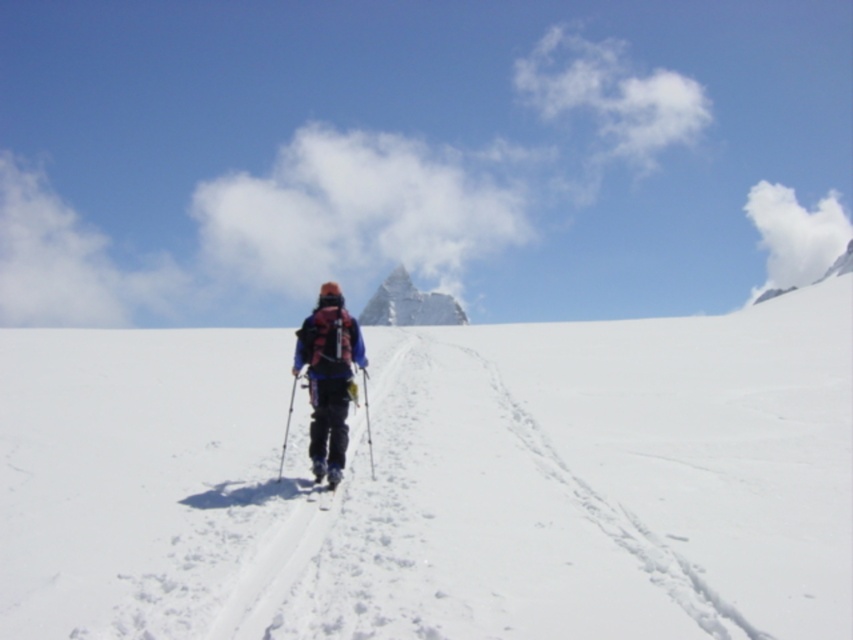
You are a hiker planning to cross the snow path. You have a white matte ski at center that you need to place on the white powdery snow at center. Can you confirm if the ski will reach the snow without needing to move it more than 90 feet?

The distance between the white powdery snow at center and the white matte ski at center is 91.75 feet, which exceeds the 90 feet limit. Therefore, the ski cannot reach the snow without moving it further.

You are a photographer capturing the snowy mountain scene. You want to ensure the matte black ski pole at center is visible in the foreground without being obstructed by the white fluffy cloud at upper right. Is this possible?

The matte black ski pole at center is behind the white fluffy cloud at upper right, so it would be obstructed and not visible in the foreground.

You are a hiker planning to take a photo of the snowy mountain landscape. You want to include both the matte pink backpack at center and the white fluffy cloud at upper right in your shot. Which object will appear smaller in the photo?

The matte pink backpack at center will appear smaller in the photo because it has a lesser width compared to the white fluffy cloud at upper right.